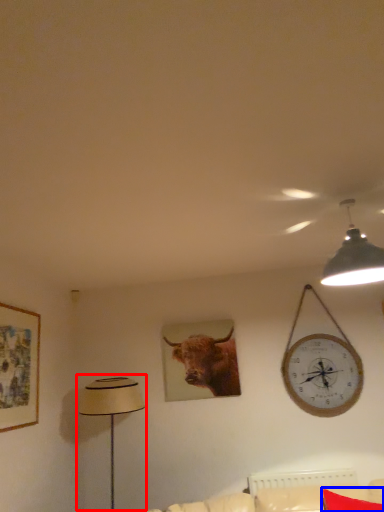
Question: Which object appears closest to the camera in this image, table lamp (highlighted by a red box) or pillow (highlighted by a blue box)?

Choices:
 (A) table lamp
 (B) pillow

Answer: (B)